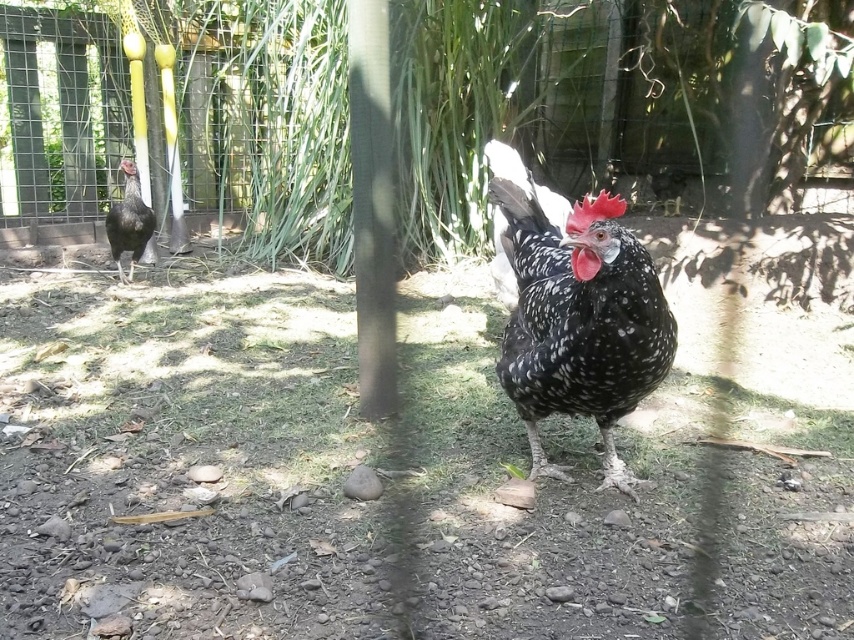
Question: Is green leafy tree at center smaller than speckled feathered chicken at center?

Choices:
 (A) no
 (B) yes

Answer: (A)

Question: Among these objects, which one is farthest from the camera?

Choices:
 (A) speckled feathered chicken at center
 (B) green leafy tree at center

Answer: (B)

Question: Can you confirm if green leafy tree at center is smaller than speckled feathered chicken at center?

Choices:
 (A) yes
 (B) no

Answer: (B)

Question: Based on their relative distances, which object is nearer to the green leafy tree at center?

Choices:
 (A) satin black chicken at left
 (B) speckled feathered chicken at center

Answer: (A)

Question: Among these points, which one is nearest to the camera?

Choices:
 (A) (519, 282)
 (B) (665, 144)
 (C) (136, 218)

Answer: (A)

Question: Is speckled feathered chicken at center smaller than satin black chicken at left?

Choices:
 (A) no
 (B) yes

Answer: (A)